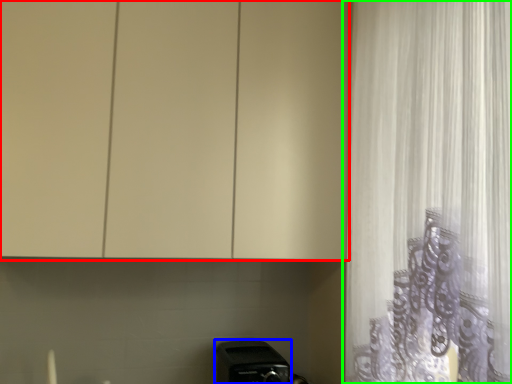
Question: Which object is the closest to the cabinetry (highlighted by a red box)? Choose among these: appliance (highlighted by a blue box) or curtain (highlighted by a green box).

Choices:
 (A) appliance
 (B) curtain

Answer: (B)